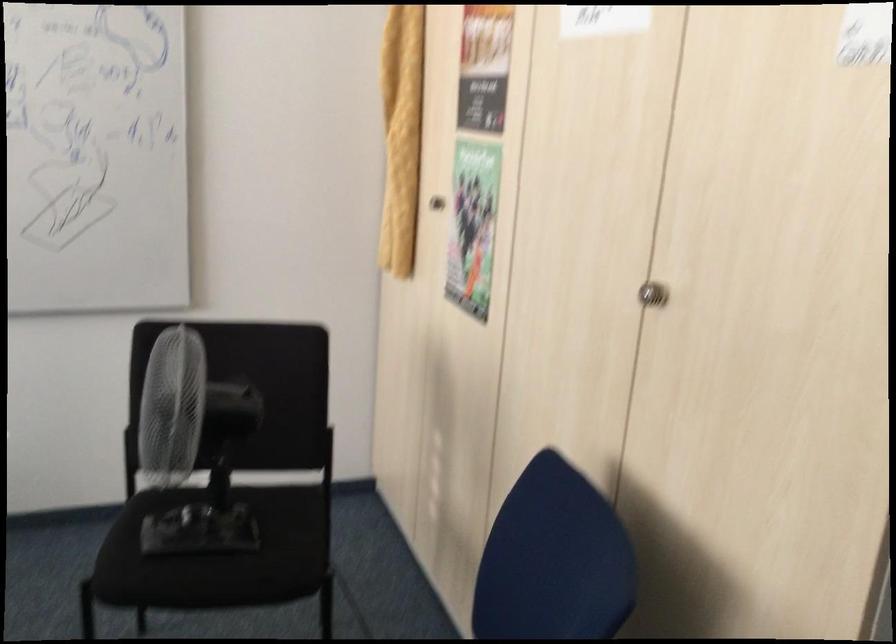
I want to click on black chair sitting surface, so click(x=220, y=521).